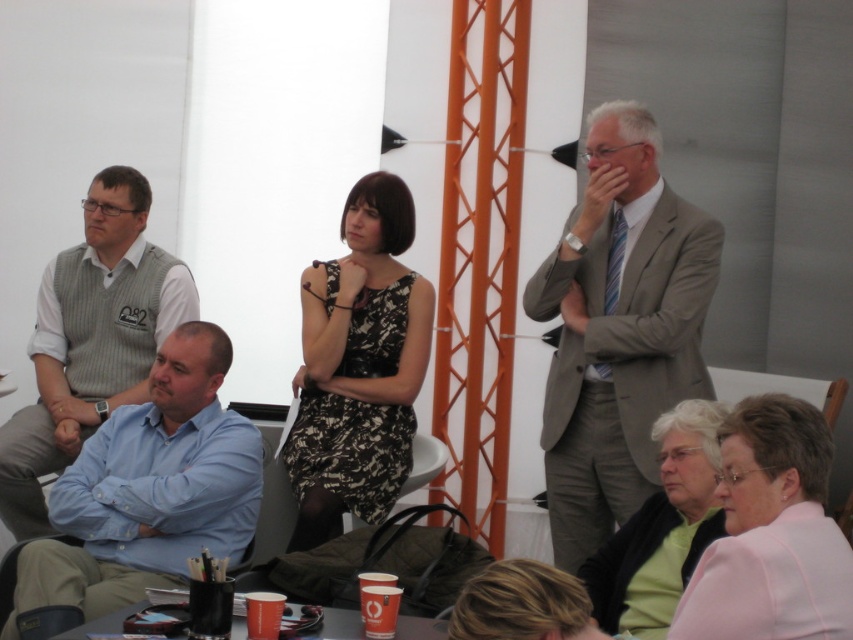
You are standing at the entrance of the room and want to find the black floral dress at center. Based on the coordinates provided, in which direction should you look to locate it?

The black floral dress at center is located at coordinates point (358, 365), so you should look towards the center of the room to find it.